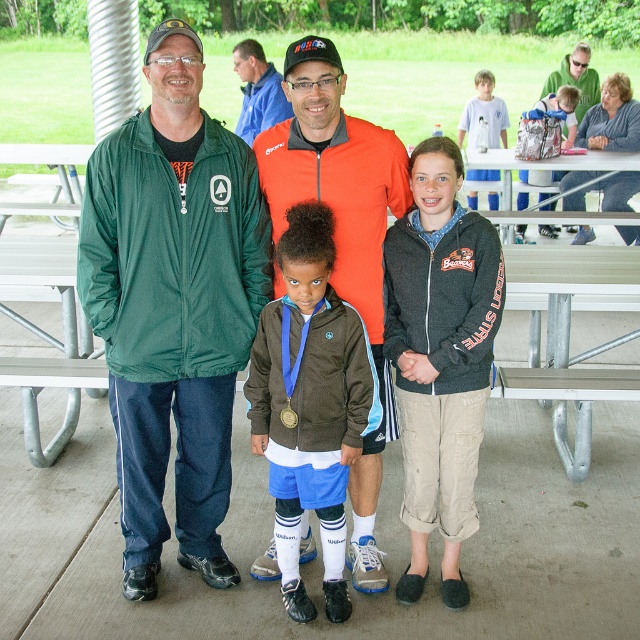
Question: Estimate the real-world distances between objects in this image. Which object is farther from the light blue jersey at center?

Choices:
 (A) green fleece jacket at left
 (B) silver metallic backpack at upper right
 (C) brown suede jacket at center
 (D) blue fleece jacket at center

Answer: (C)

Question: Is green fleece jacket at left to the left of blue fleece jacket at center from the viewer's perspective?

Choices:
 (A) no
 (B) yes

Answer: (B)

Question: Considering the relative positions of brown suede jacket at center and light blue jersey at center in the image provided, where is brown suede jacket at center located with respect to light blue jersey at center?

Choices:
 (A) right
 (B) left

Answer: (B)

Question: Which object is farther from the camera taking this photo?

Choices:
 (A) silver metallic backpack at upper right
 (B) brown suede jacket at center

Answer: (A)

Question: Among these objects, which one is nearest to the camera?

Choices:
 (A) gold shiny medal at center
 (B) blue fleece jacket at center
 (C) green fleece jacket at left
 (D) silver metallic backpack at upper right

Answer: (C)

Question: Where is dark gray fleece jacket at center located in relation to blue fleece jacket at center in the image?

Choices:
 (A) above
 (B) below

Answer: (B)